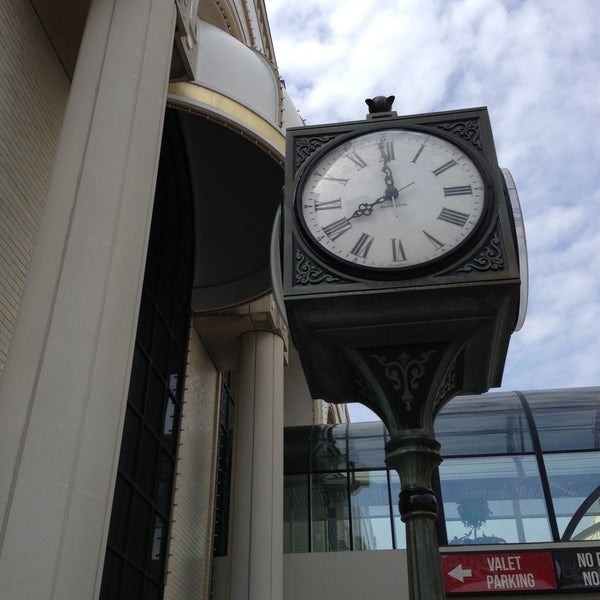
The image size is (600, 600). I want to click on windows, so click(135, 468).